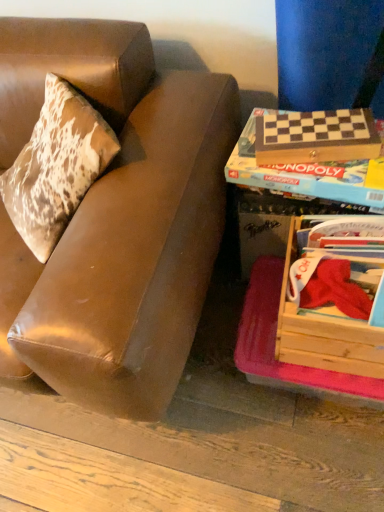
Question: Does wooden checkered board at right, placed as the 1th paperback book when sorted from bottom to top, have a greater width compared to wooden crate at lower right?

Choices:
 (A) no
 (B) yes

Answer: (A)

Question: Is wooden checkered board at right, the second paperback book in the top-to-bottom sequence, thinner than wooden crate at lower right?

Choices:
 (A) no
 (B) yes

Answer: (B)

Question: Considering the relative sizes of wooden checkered board at right, placed as the 1th paperback book when sorted from bottom to top, and wooden crate at lower right in the image provided, is wooden checkered board at right, placed as the 1th paperback book when sorted from bottom to top, smaller than wooden crate at lower right?

Choices:
 (A) no
 (B) yes

Answer: (B)

Question: Is wooden checkered board at right, placed as the 1th paperback book when sorted from bottom to top, taller than wooden crate at lower right?

Choices:
 (A) yes
 (B) no

Answer: (B)

Question: Can you confirm if wooden checkered board at right, the second paperback book in the top-to-bottom sequence, is shorter than wooden crate at lower right?

Choices:
 (A) no
 (B) yes

Answer: (B)

Question: Is wooden checkered board at right, placed as the 1th paperback book when sorted from bottom to top, closer to the viewer compared to wooden crate at lower right?

Choices:
 (A) yes
 (B) no

Answer: (B)

Question: Is wooden checkered board at right, the second paperback book in the top-to-bottom sequence, with brown leather couch at left?

Choices:
 (A) no
 (B) yes

Answer: (A)

Question: From a real-world perspective, is wooden checkered board at right, placed as the 1th paperback book when sorted from bottom to top, positioned under brown leather couch at left based on gravity?

Choices:
 (A) yes
 (B) no

Answer: (B)

Question: Is wooden checkered board at right, placed as the 1th paperback book when sorted from bottom to top, bigger than brown leather couch at left?

Choices:
 (A) yes
 (B) no

Answer: (B)

Question: Can you confirm if wooden checkered board at right, the second paperback book in the top-to-bottom sequence, is smaller than brown leather couch at left?

Choices:
 (A) no
 (B) yes

Answer: (B)

Question: From the image's perspective, is wooden checkered board at right, the second paperback book in the top-to-bottom sequence, under brown leather couch at left?

Choices:
 (A) no
 (B) yes

Answer: (A)

Question: From the image's perspective, does wooden checkered board at right, the second paperback book in the top-to-bottom sequence, appear higher than brown leather couch at left?

Choices:
 (A) yes
 (B) no

Answer: (A)

Question: Is brown leather couch at left positioned far away from wooden checkered board at right, placed as the 1th paperback book when sorted from bottom to top?

Choices:
 (A) yes
 (B) no

Answer: (B)